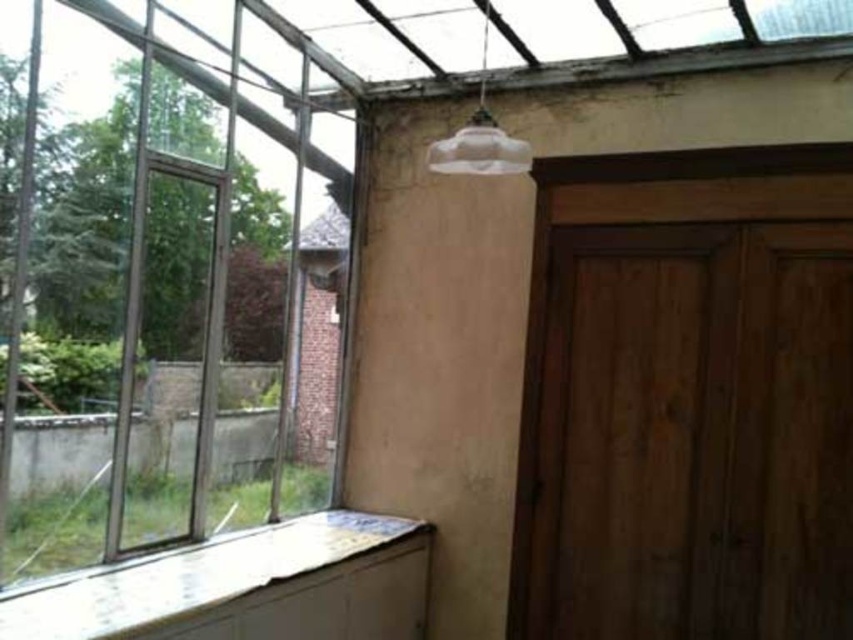
Question: Can you confirm if clear glass window at left is positioned above white painted wood at lower left?

Choices:
 (A) yes
 (B) no

Answer: (A)

Question: Which object appears farthest from the camera in this image?

Choices:
 (A) clear glass window at left
 (B) translucent glass lampshade at upper center
 (C) white painted wood at lower left

Answer: (B)

Question: Can you confirm if clear glass window at left is thinner than translucent glass lampshade at upper center?

Choices:
 (A) yes
 (B) no

Answer: (B)

Question: Which is farther from the clear glass window at left?

Choices:
 (A) white painted wood at lower left
 (B) translucent glass lampshade at upper center

Answer: (B)

Question: Is clear glass window at left wider than white painted wood at lower left?

Choices:
 (A) no
 (B) yes

Answer: (A)

Question: Estimate the real-world distances between objects in this image. Which object is farther from the white painted wood at lower left?

Choices:
 (A) clear glass window at left
 (B) translucent glass lampshade at upper center

Answer: (B)